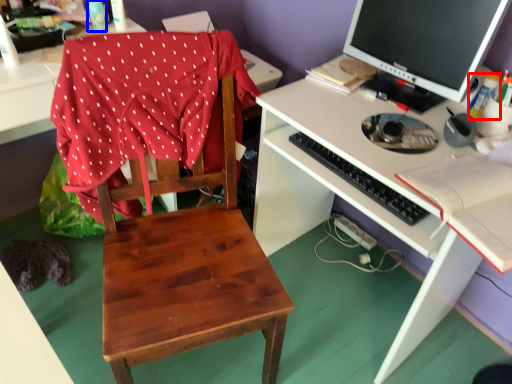
Question: Which of the following is the closest to the observer, bottle (highlighted by a red box) or bottle (highlighted by a blue box)?

Choices:
 (A) bottle
 (B) bottle

Answer: (A)